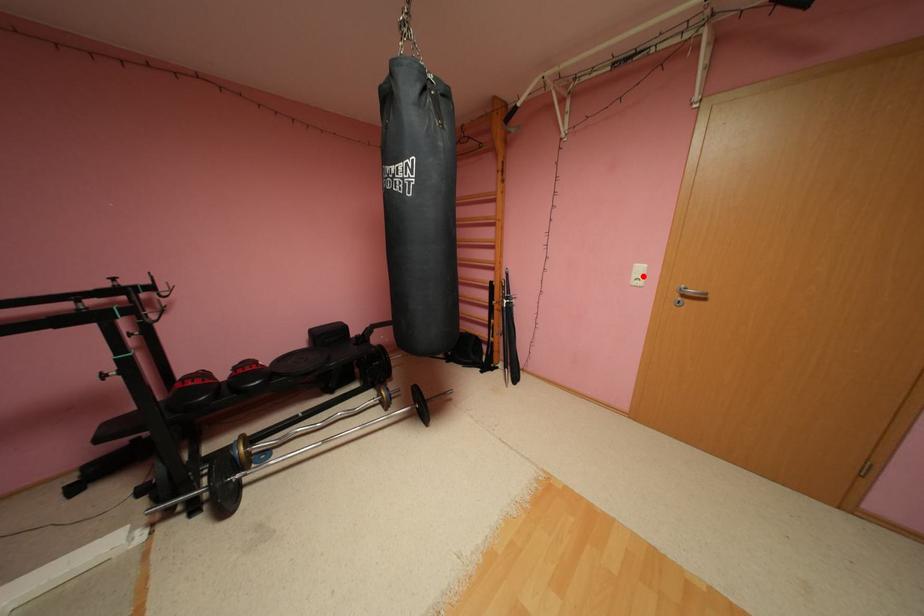
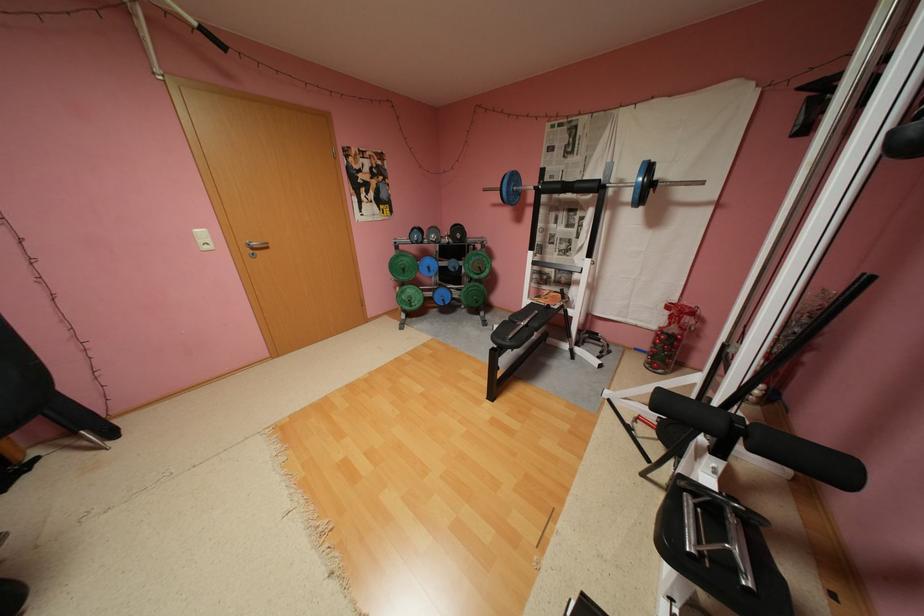
The point at the highlighted location is marked in the first image. Where is the corresponding point in the second image?

(210, 241)